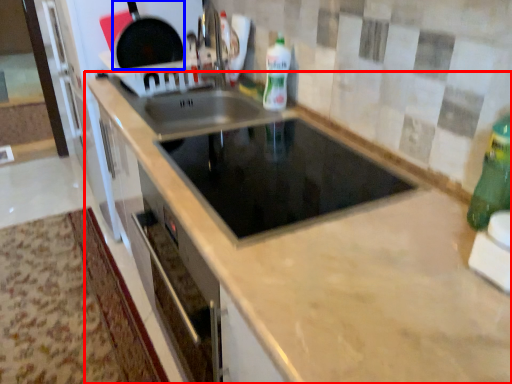
Question: Which object is further to the camera taking this photo, countertop (highlighted by a red box) or frying pan (highlighted by a blue box)?

Choices:
 (A) countertop
 (B) frying pan

Answer: (B)